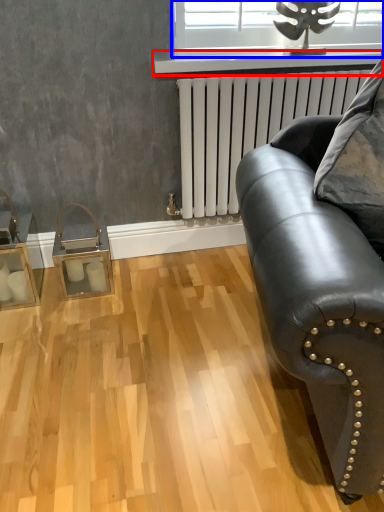
Question: Which point is further to the camera, window sill (highlighted by a red box) or window (highlighted by a blue box)?

Choices:
 (A) window sill
 (B) window

Answer: (B)